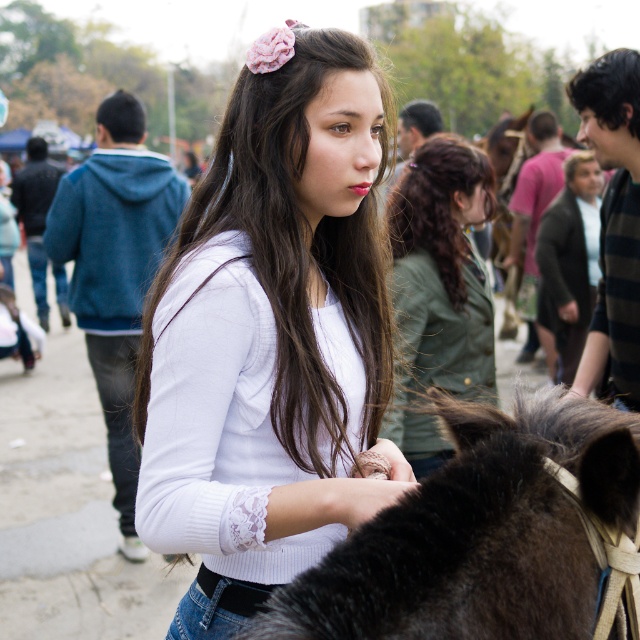
You are a photographer trying to capture a closeup shot of the dark brown fur at center and the white lace shirt at center. Since your camera can only focus on one object at a time, which object should you choose to ensure the smaller one is in focus?

The dark brown fur at center is smaller in size compared to the white lace shirt at center, so you should focus on the dark brown fur at center to ensure it is in focus.

Based on the photo, you are a photographer at the event and want to capture a shot focusing on the white lace sweater at center and the dark brown fur at center. Which object should you adjust your camera focus on first if you want to ensure both are in focus?

The white lace sweater at center is above dark brown fur at center, so you should focus on the white lace sweater at center first as it is closer to the camera.